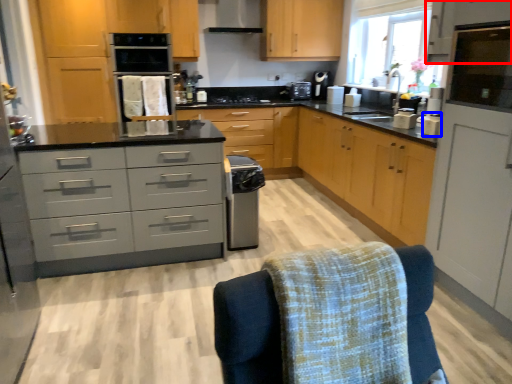
Question: Which object is further to the camera taking this photo, cabinetry (highlighted by a red box) or appliance (highlighted by a blue box)?

Choices:
 (A) cabinetry
 (B) appliance

Answer: (B)